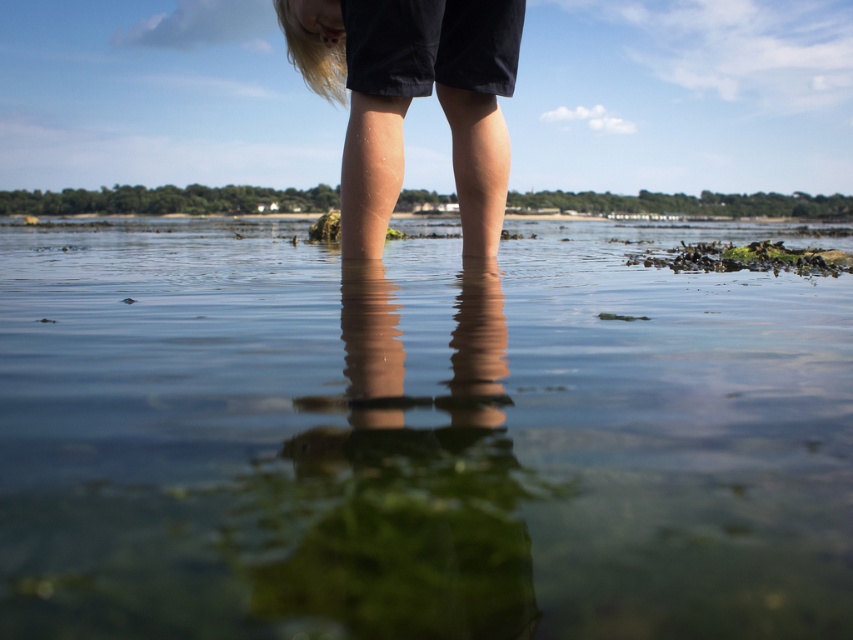
Question: Does clear water at center appear on the right side of black matte shorts at center?

Choices:
 (A) no
 (B) yes

Answer: (B)

Question: Which of the following is the farthest from the observer?

Choices:
 (A) black matte shorts at center
 (B) clear water at center

Answer: (A)

Question: Can you confirm if clear water at center is bigger than black matte shorts at center?

Choices:
 (A) no
 (B) yes

Answer: (B)

Question: Among these points, which one is farthest from the camera?

Choices:
 (A) [x=318, y=566]
 (B) [x=351, y=90]

Answer: (B)

Question: Is the position of clear water at center more distant than that of black matte shorts at center?

Choices:
 (A) yes
 (B) no

Answer: (B)